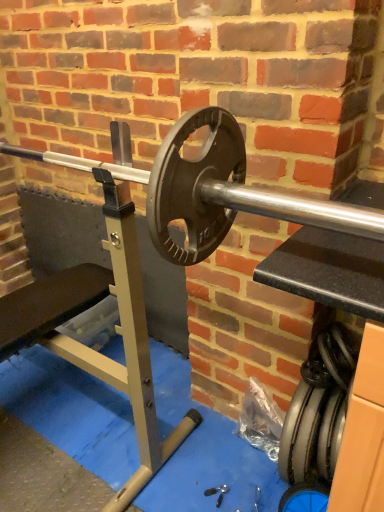
Question: Is rubber/smooth tire at lower right in front of or behind polished silver barbell at center in the image?

Choices:
 (A) front
 (B) behind

Answer: (B)

Question: Looking at the image, does rubber/smooth tire at lower right seem bigger or smaller compared to polished silver barbell at center?

Choices:
 (A) big
 (B) small

Answer: (B)

Question: From the image's perspective, is rubber/smooth tire at lower right positioned above or below polished silver barbell at center?

Choices:
 (A) above
 (B) below

Answer: (B)

Question: Would you say polished silver barbell at center is inside or outside rubber/smooth tire at lower right?

Choices:
 (A) outside
 (B) inside

Answer: (A)

Question: Considering their positions, is polished silver barbell at center located in front of or behind rubber/smooth tire at lower right?

Choices:
 (A) front
 (B) behind

Answer: (A)

Question: From the image's perspective, is polished silver barbell at center positioned above or below rubber/smooth tire at lower right?

Choices:
 (A) above
 (B) below

Answer: (A)

Question: In terms of width, does polished silver barbell at center look wider or thinner when compared to rubber/smooth tire at lower right?

Choices:
 (A) thin
 (B) wide

Answer: (B)